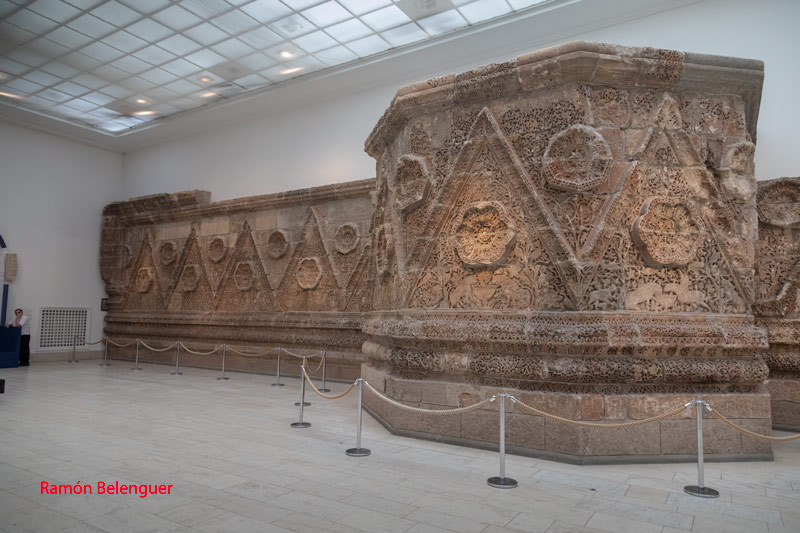
Find the location of a particular element. The height and width of the screenshot is (533, 800). lights in ceiling is located at coordinates (200, 80), (286, 59), (142, 96).